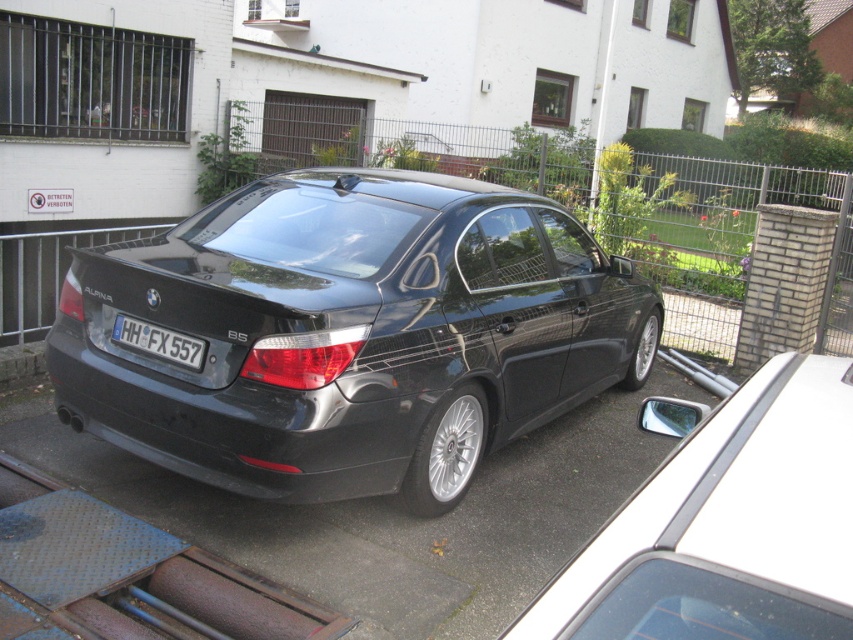
Question: Which object appears closest to the camera in this image?

Choices:
 (A) black asphalt driveway at center
 (B) glossy black sedan at center

Answer: (B)

Question: Is glossy black sedan at center behind white plastic license plate at center?

Choices:
 (A) no
 (B) yes

Answer: (A)

Question: Is glossy black sedan at center wider than white plastic license plate at center?

Choices:
 (A) yes
 (B) no

Answer: (A)

Question: Estimate the real-world distances between objects in this image. Which object is farther from the glossy black car at center?

Choices:
 (A) glossy black sedan at center
 (B) white plastic license plate at center

Answer: (A)

Question: Can you confirm if black asphalt driveway at center is thinner than glossy black sedan at center?

Choices:
 (A) yes
 (B) no

Answer: (B)

Question: Which is farther from the glossy black car at center?

Choices:
 (A) glossy black sedan at center
 (B) black asphalt driveway at center
 (C) white plastic license plate at center

Answer: (A)